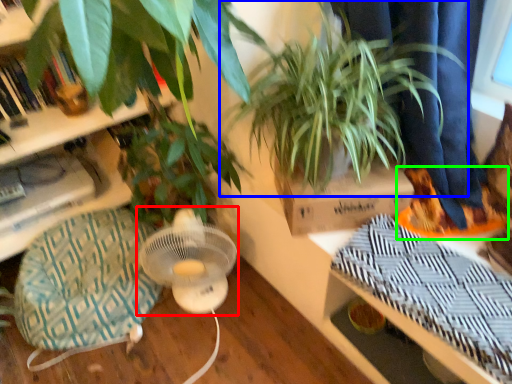
Question: Based on their relative distances, which object is farther from mechanical fan (highlighted by a red box)? Choose from houseplant (highlighted by a blue box) and shoe (highlighted by a green box).

Choices:
 (A) houseplant
 (B) shoe

Answer: (B)